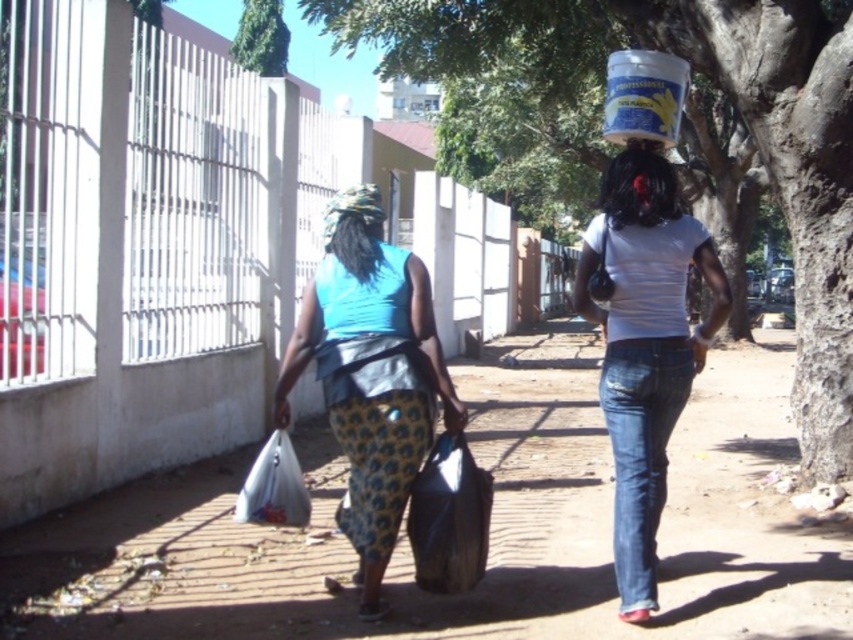
Based on the photo, between white matte shirt at center and matte white bucket at upper center, which one appears on the right side from the viewer's perspective?

Positioned to the right is white matte shirt at center.

Is white matte shirt at center in front of matte white bucket at upper center?

Yes.

Find the location of a particular element. This screenshot has height=640, width=853. white matte shirt at center is located at coordinates (643, 346).

The width and height of the screenshot is (853, 640). I want to click on white plastic bag at lower left, so click(274, 486).

Does white plastic bag at lower left come in front of patterned fabric headscarf at center?

Yes, white plastic bag at lower left is closer to the viewer.

Is point (300, 525) positioned behind point (338, 208)?

No, it is in front of (338, 208).

You are a GUI agent. You are given a task and a screenshot of the screen. Output one action in this format:
    pyautogui.click(x=<x>, y=<y>)
    Task: Click on the white plastic bag at lower left
    This screenshot has width=853, height=640.
    Given the screenshot: What is the action you would take?
    pyautogui.click(x=274, y=486)

Is black plastic bag at center to the right of matte white bucket at upper center from the viewer's perspective?

No, black plastic bag at center is not to the right of matte white bucket at upper center.

Who is more distant from viewer, (422, 536) or (634, 163)?

Positioned behind is point (634, 163).

Which is in front, point (444, 458) or point (612, 168)?

Point (444, 458) is more forward.

The image size is (853, 640). What are the coordinates of `black plastic bag at center` in the screenshot? It's located at (450, 516).